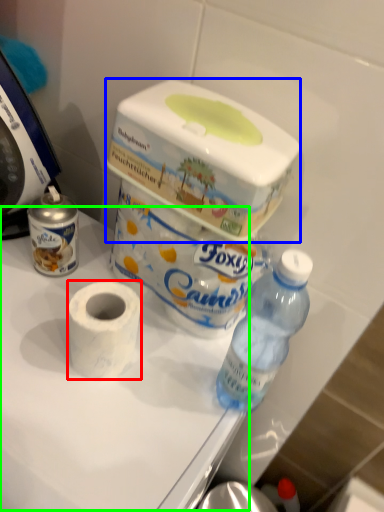
Question: Estimate the real-world distances between objects in this image. Which object is farther from toilet paper (highlighted by a red box), box (highlighted by a blue box) or table (highlighted by a green box)?

Choices:
 (A) box
 (B) table

Answer: (A)